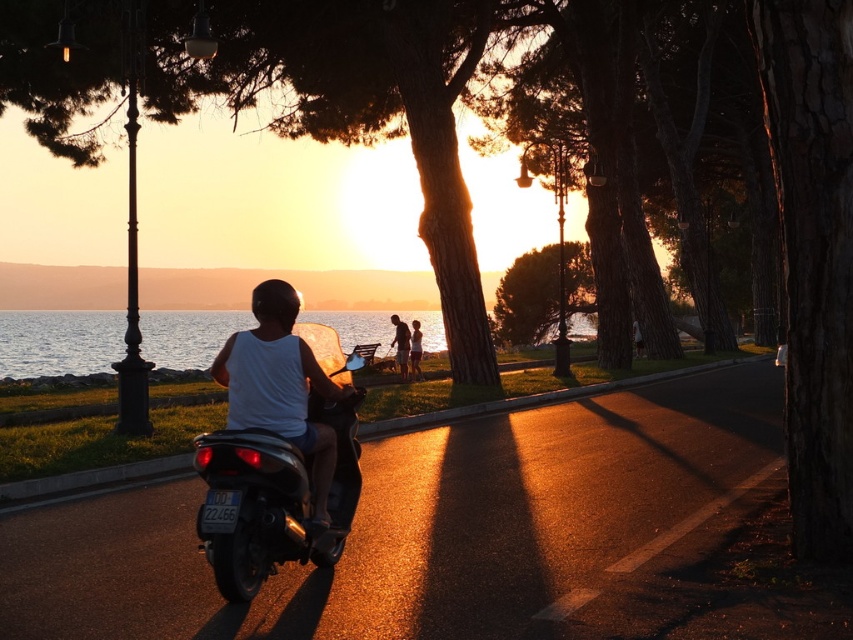
Where is `white matte tank top at center`? The image size is (853, 640). white matte tank top at center is located at coordinates (280, 385).